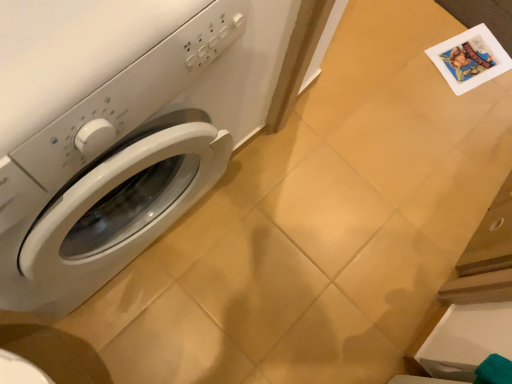
At what (x,y) coordinates should I click in order to perform the action: click on white glossy washing machine at left. Please return your answer as a coordinate pair (x, y). This screenshot has height=384, width=512. Looking at the image, I should click on (111, 171).

The height and width of the screenshot is (384, 512). Describe the element at coordinates (111, 171) in the screenshot. I see `white glossy washing machine at left` at that location.

What is the approximate width of white glossy washing machine at left?

white glossy washing machine at left is 19.92 inches wide.

At what (x,y) coordinates should I click in order to perform the action: click on white glossy washing machine at left. Please return your answer as a coordinate pair (x, y). The height and width of the screenshot is (384, 512). Looking at the image, I should click on 111,171.